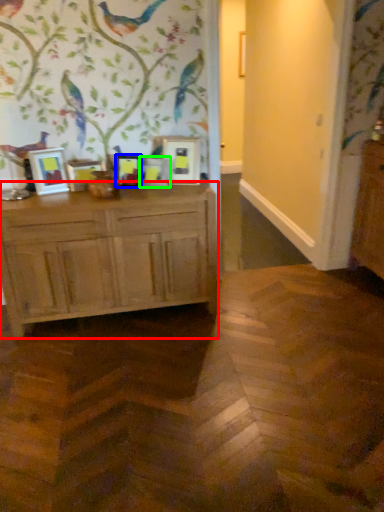
Question: Based on their relative distances, which object is farther from chest of drawers (highlighted by a red box)? Choose from picture frame (highlighted by a blue box) and picture frame (highlighted by a green box).

Choices:
 (A) picture frame
 (B) picture frame

Answer: (B)